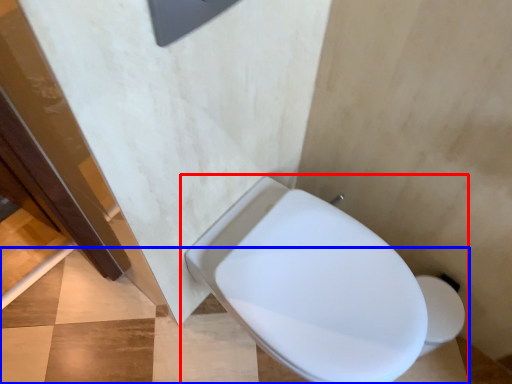
Question: Which object is closer to the camera taking this photo, toilet (highlighted by a red box) or concrete (highlighted by a blue box)?

Choices:
 (A) toilet
 (B) concrete

Answer: (A)